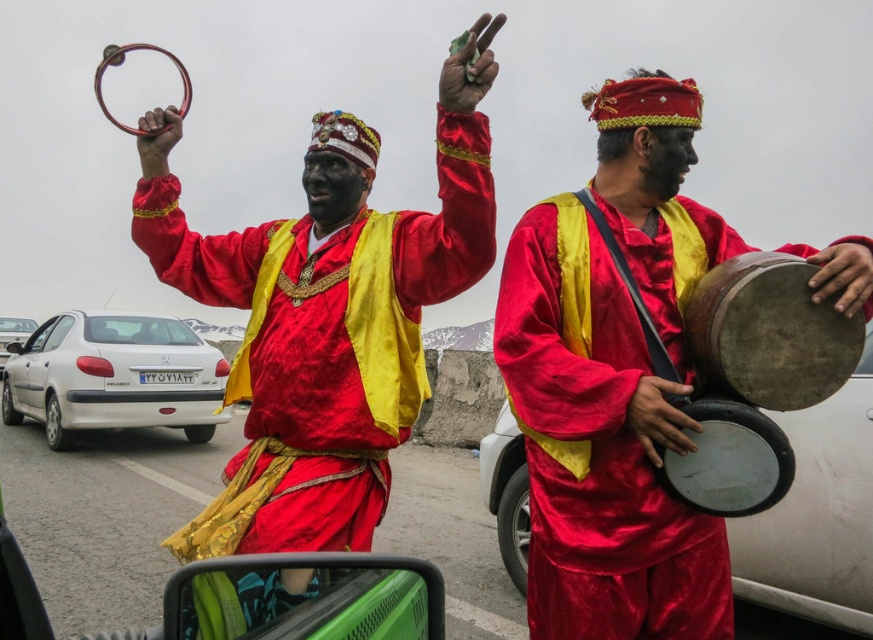
Question: Among these points, which one is farthest from the camera?

Choices:
 (A) (0, 340)
 (B) (359, 378)
 (C) (671, 406)
 (D) (102, 369)

Answer: (A)

Question: Is satin red vest at upper center smaller than wooden drum at right?

Choices:
 (A) no
 (B) yes

Answer: (A)

Question: Among these objects, which one is farthest from the camera?

Choices:
 (A) white glossy sedan at left
 (B) satin red vest at upper center
 (C) matte brown drum at right

Answer: (A)

Question: Which point is farther to the camera?

Choices:
 (A) (12, 337)
 (B) (177, 355)
 (C) (755, 449)
 (D) (545, 577)

Answer: (A)

Question: Is white matte sedan at lower left below white glossy sedan at left?

Choices:
 (A) yes
 (B) no

Answer: (A)

Question: In this image, where is white matte sedan at lower left located relative to matte brown drum at right?

Choices:
 (A) right
 (B) left

Answer: (B)